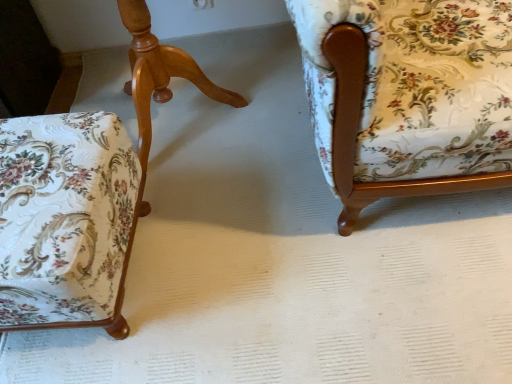
Measure the distance between point (442,189) and camera.

35.08 inches.

At what (x,y) coordinates should I click in order to perform the action: click on floral fabric ottoman at lower left, the third chair viewed from the right. Please return your answer as a coordinate pair (x, y). This screenshot has height=384, width=512. Looking at the image, I should click on (66, 220).

Is floral fabric chair at right, placed as the third chair when sorted from left to right, at the right side of floral fabric chair at left, arranged as the 2th chair when viewed from the left?

Yes.

Considering the points (381, 37) and (202, 88), which point is behind, point (381, 37) or point (202, 88)?

Positioned behind is point (202, 88).

This screenshot has width=512, height=384. Identify the location of chair above the floral fabric chair at left, arranged as the 2th chair when viewed from the left (from a real-world perspective). (408, 96).

Considering the positions of objects floral fabric chair at right, which is the 1th chair in right-to-left order, and floral fabric ottoman at lower left, the third chair viewed from the right, in the image provided, who is more to the right, floral fabric chair at right, which is the 1th chair in right-to-left order, or floral fabric ottoman at lower left, the third chair viewed from the right,?

floral fabric chair at right, which is the 1th chair in right-to-left order.

From the image's perspective, is floral fabric chair at right, which is the 1th chair in right-to-left order, below floral fabric ottoman at lower left, arranged as the first chair when viewed from the left?

Incorrect, from the image's perspective, floral fabric chair at right, which is the 1th chair in right-to-left order, is higher than floral fabric ottoman at lower left, arranged as the first chair when viewed from the left.

Is floral fabric chair at right, placed as the third chair when sorted from left to right, not within floral fabric ottoman at lower left, the third chair viewed from the right?

Yes, floral fabric chair at right, placed as the third chair when sorted from left to right, is not within floral fabric ottoman at lower left, the third chair viewed from the right.

Is point (359, 48) closer or farther from the camera than point (62, 142)?

Clearly, point (359, 48) is closer to the camera than point (62, 142).

Is floral fabric ottoman at lower left, the third chair viewed from the right, bigger or smaller than floral fabric chair at right, placed as the third chair when sorted from left to right?

floral fabric ottoman at lower left, the third chair viewed from the right, is smaller than floral fabric chair at right, placed as the third chair when sorted from left to right.

You are a GUI agent. You are given a task and a screenshot of the screen. Output one action in this format:
    pyautogui.click(x=<x>, y=<y>)
    Task: Click on the chair that is the 2nd one below the floral fabric chair at right, which is the 1th chair in right-to-left order (from a real-world perspective)
    This screenshot has height=384, width=512.
    Given the screenshot: What is the action you would take?
    pyautogui.click(x=66, y=220)

Could you measure the distance between floral fabric ottoman at lower left, arranged as the first chair when viewed from the left, and floral fabric chair at right, which is the 1th chair in right-to-left order?

They are 21.57 inches apart.

Would you say floral fabric ottoman at lower left, arranged as the first chair when viewed from the left, is inside or outside floral fabric chair at right, which is the 1th chair in right-to-left order?

floral fabric ottoman at lower left, arranged as the first chair when viewed from the left, is outside floral fabric chair at right, which is the 1th chair in right-to-left order.

Is floral fabric ottoman at lower left, arranged as the first chair when viewed from the left, turned away from floral fabric chair at left, the 2th chair viewed from the right?

No, floral fabric ottoman at lower left, arranged as the first chair when viewed from the left,'s orientation is not away from floral fabric chair at left, the 2th chair viewed from the right.

Who is taller, floral fabric ottoman at lower left, the third chair viewed from the right, or floral fabric chair at left, the 2th chair viewed from the right?

Standing taller between the two is floral fabric chair at left, the 2th chair viewed from the right.

Would you say floral fabric ottoman at lower left, the third chair viewed from the right, is a long distance from floral fabric chair at left, arranged as the 2th chair when viewed from the left?

No, floral fabric ottoman at lower left, the third chair viewed from the right, is not far from floral fabric chair at left, arranged as the 2th chair when viewed from the left.

Is floral fabric ottoman at lower left, arranged as the first chair when viewed from the left, bigger or smaller than floral fabric chair at left, the 2th chair viewed from the right?

Considering their sizes, floral fabric ottoman at lower left, arranged as the first chair when viewed from the left, takes up less space than floral fabric chair at left, the 2th chair viewed from the right.

Is floral fabric chair at left, arranged as the 2th chair when viewed from the left, looking in the opposite direction of floral fabric chair at right, which is the 1th chair in right-to-left order?

No.

Visually, is floral fabric chair at left, arranged as the 2th chair when viewed from the left, positioned to the left or to the right of floral fabric chair at right, which is the 1th chair in right-to-left order?

Based on their positions, floral fabric chair at left, arranged as the 2th chair when viewed from the left, is located to the left of floral fabric chair at right, which is the 1th chair in right-to-left order.

Are floral fabric chair at left, the 2th chair viewed from the right, and floral fabric chair at right, which is the 1th chair in right-to-left order, far apart?

No, there isn't a large distance between floral fabric chair at left, the 2th chair viewed from the right, and floral fabric chair at right, which is the 1th chair in right-to-left order.

Would you say floral fabric chair at left, the 2th chair viewed from the right, is inside or outside floral fabric ottoman at lower left, the third chair viewed from the right?

floral fabric chair at left, the 2th chair viewed from the right, is spatially situated outside floral fabric ottoman at lower left, the third chair viewed from the right.

Is floral fabric chair at left, the 2th chair viewed from the right, looking in the opposite direction of floral fabric ottoman at lower left, arranged as the first chair when viewed from the left?

No, floral fabric chair at left, the 2th chair viewed from the right, is not facing away from floral fabric ottoman at lower left, arranged as the first chair when viewed from the left.

Could you measure the distance between floral fabric chair at left, arranged as the 2th chair when viewed from the left, and floral fabric ottoman at lower left, arranged as the first chair when viewed from the left?

They are 7.82 inches apart.

Looking at this image, how many degrees apart are the facing directions of floral fabric chair at left, arranged as the 2th chair when viewed from the left, and floral fabric ottoman at lower left, the third chair viewed from the right?

The facing directions of floral fabric chair at left, arranged as the 2th chair when viewed from the left, and floral fabric ottoman at lower left, the third chair viewed from the right, are 177 degrees apart.

Where is `chair above the floral fabric chair at left, the 2th chair viewed from the right (from the image's perspective)`? Image resolution: width=512 pixels, height=384 pixels. chair above the floral fabric chair at left, the 2th chair viewed from the right (from the image's perspective) is located at coordinates (408, 96).

Which chair is the 2nd one when counting from the left side of the floral fabric chair at right, which is the 1th chair in right-to-left order? Please provide its 2D coordinates.

[(66, 220)]

Estimate the real-world distances between objects in this image. Which object is closer to floral fabric ottoman at lower left, the third chair viewed from the right, floral fabric chair at right, which is the 1th chair in right-to-left order, or floral fabric chair at left, the 2th chair viewed from the right?

floral fabric chair at left, the 2th chair viewed from the right.

Estimate the real-world distances between objects in this image. Which object is further from floral fabric chair at right, placed as the third chair when sorted from left to right, floral fabric chair at left, arranged as the 2th chair when viewed from the left, or floral fabric ottoman at lower left, arranged as the first chair when viewed from the left?

Based on the image, floral fabric chair at left, arranged as the 2th chair when viewed from the left, appears to be further to floral fabric chair at right, placed as the third chair when sorted from left to right.

Considering their positions, is floral fabric ottoman at lower left, arranged as the first chair when viewed from the left, positioned closer to floral fabric chair at right, which is the 1th chair in right-to-left order, than floral fabric chair at left, arranged as the 2th chair when viewed from the left?

floral fabric ottoman at lower left, arranged as the first chair when viewed from the left, lies closer to floral fabric chair at right, which is the 1th chair in right-to-left order, than the other object.

When comparing their distances from floral fabric ottoman at lower left, arranged as the first chair when viewed from the left, does floral fabric chair at left, the 2th chair viewed from the right, or floral fabric chair at right, placed as the third chair when sorted from left to right, seem further?

floral fabric chair at right, placed as the third chair when sorted from left to right, lies further to floral fabric ottoman at lower left, arranged as the first chair when viewed from the left, than the other object.

Looking at this image, which object lies further to the anchor point floral fabric chair at left, arranged as the 2th chair when viewed from the left, floral fabric chair at right, which is the 1th chair in right-to-left order, or floral fabric ottoman at lower left, the third chair viewed from the right?

floral fabric chair at right, which is the 1th chair in right-to-left order.

Looking at the image, which one is located further to floral fabric chair at left, the 2th chair viewed from the right, floral fabric ottoman at lower left, the third chair viewed from the right, or floral fabric chair at right, which is the 1th chair in right-to-left order?

Based on the image, floral fabric chair at right, which is the 1th chair in right-to-left order, appears to be further to floral fabric chair at left, the 2th chair viewed from the right.

Locate an element on the screen. The image size is (512, 384). chair between floral fabric ottoman at lower left, arranged as the first chair when viewed from the left, and floral fabric chair at right, placed as the third chair when sorted from left to right, in the horizontal direction is located at coordinates (147, 121).